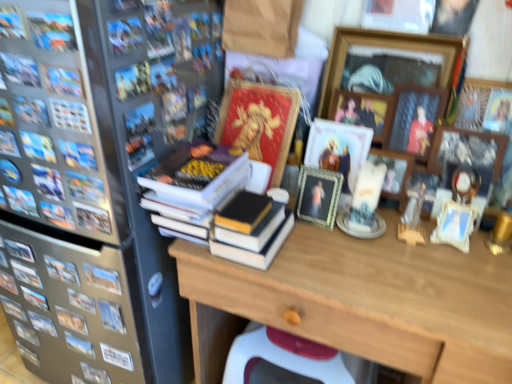
From the picture: How much space does wooden picture frame at upper center, arranged as the second picture frame when viewed from the left, occupy horizontally?

wooden picture frame at upper center, arranged as the second picture frame when viewed from the left, is 3.09 inches wide.

Measure the distance between wooden picture frame at upper center, which is counted as the fourth picture frame, starting from the right, and camera.

They are 3.39 feet apart.

This screenshot has height=384, width=512. What do you see at coordinates (224, 202) in the screenshot? I see `hardcover books at center, positioned as the 2th book in top-to-bottom order` at bounding box center [224, 202].

Where is `metallic gray refrigerator at left`? metallic gray refrigerator at left is located at coordinates (76, 218).

Identify the location of hardcover book at left, the second book when ordered from left to right. (93, 218).

Measure the distance between point (x=331, y=51) and camera.

Point (x=331, y=51) and camera are 3.61 feet apart.

You are a GUI agent. You are given a task and a screenshot of the screen. Output one action in this format:
    pyautogui.click(x=<x>, y=<y>)
    Task: Click on the green textured frame at center, placed as the first picture frame when sorted from left to right
    This screenshot has height=384, width=512.
    Given the screenshot: What is the action you would take?
    pyautogui.click(x=318, y=196)

Which is behind, red matte book at center or metallic gray refrigerator at left?

red matte book at center is further away from the camera.

Is red matte book at center placed right next to metallic gray refrigerator at left?

No, red matte book at center is not with metallic gray refrigerator at left.

In terms of height, does red matte book at center look taller or shorter compared to metallic gray refrigerator at left?

red matte book at center is shorter than metallic gray refrigerator at left.

Could you tell me if red matte book at center is facing metallic gray refrigerator at left?

No.

Looking at this image, from a real-world perspective, which is physically below, green textured frame at center, the fifth picture frame when ordered from right to left, or wooden picture frame at upper right, the third picture frame from the left?

green textured frame at center, the fifth picture frame when ordered from right to left, from a real-world perspective.

Is green textured frame at center, the fifth picture frame when ordered from right to left, not inside wooden picture frame at upper right, the third picture frame from the left?

green textured frame at center, the fifth picture frame when ordered from right to left, is positioned outside wooden picture frame at upper right, the third picture frame from the left.

Does green textured frame at center, the fifth picture frame when ordered from right to left, appear on the right side of wooden picture frame at upper right, the third picture frame from the left?

In fact, green textured frame at center, the fifth picture frame when ordered from right to left, is to the left of wooden picture frame at upper right, the third picture frame from the left.

Between green textured frame at center, the fifth picture frame when ordered from right to left, and wooden picture frame at upper right, the third picture frame from the left, which one is positioned behind?

wooden picture frame at upper right, the third picture frame from the left, is behind.

From the picture: From the image's perspective, is matte black book at upper left, which appears as the second book when viewed from the right, under wooden picture frame at upper right, arranged as the 4th picture frame when viewed from the left?

No.

Considering the relative positions of matte black book at upper left, acting as the 4th book starting from the bottom, and wooden picture frame at upper right, which is the 2th picture frame from right to left, in the image provided, is matte black book at upper left, acting as the 4th book starting from the bottom, to the right of wooden picture frame at upper right, which is the 2th picture frame from right to left, from the viewer's perspective?

No.

Considering their positions, is matte black book at upper left, the third book in the left-to-right sequence, located in front of or behind wooden picture frame at upper right, which is the 2th picture frame from right to left?

Clearly, matte black book at upper left, the third book in the left-to-right sequence, is in front of wooden picture frame at upper right, which is the 2th picture frame from right to left.

Which object is thinner, matte black book at upper left, the third book in the left-to-right sequence, or wooden picture frame at upper right, arranged as the 4th picture frame when viewed from the left?

Thinner between the two is matte black book at upper left, the third book in the left-to-right sequence.

Can you confirm if metallic gray refrigerator at left is positioned to the right of green textured frame at center, the fifth picture frame when ordered from right to left?

In fact, metallic gray refrigerator at left is to the left of green textured frame at center, the fifth picture frame when ordered from right to left.

Is metallic gray refrigerator at left spatially inside green textured frame at center, the fifth picture frame when ordered from right to left, or outside of it?

metallic gray refrigerator at left exists outside the volume of green textured frame at center, the fifth picture frame when ordered from right to left.

Starting from the metallic gray refrigerator at left, which picture frame is the 2nd one behind? Please provide its 2D coordinates.

[(318, 196)]

From the image's perspective, is hardcover book at left, the 3th book in the top-to-bottom sequence, positioned above or below hardcover book at left, the 4th book positioned from the top?

Based on their image positions, hardcover book at left, the 3th book in the top-to-bottom sequence, is located above hardcover book at left, the 4th book positioned from the top.

Is hardcover book at left, the 3th book in the top-to-bottom sequence, situated inside hardcover book at left, acting as the 1th book starting from the left, or outside?

hardcover book at left, the 3th book in the top-to-bottom sequence, is located beyond the bounds of hardcover book at left, acting as the 1th book starting from the left.

Can you confirm if hardcover book at left, the second book when ordered from left to right, is thinner than hardcover book at left, placed as the first book when sorted from bottom to top?

Correct, the width of hardcover book at left, the second book when ordered from left to right, is less than that of hardcover book at left, placed as the first book when sorted from bottom to top.

What's the angular difference between green textured frame at center, placed as the first picture frame when sorted from left to right, and wooden picture frame at upper right, the fifth picture frame in the left-to-right sequence,'s facing directions?

The angle between the facing direction of green textured frame at center, placed as the first picture frame when sorted from left to right, and the facing direction of wooden picture frame at upper right, the fifth picture frame in the left-to-right sequence, is 0.000789 degrees.

Which is more to the left, green textured frame at center, placed as the first picture frame when sorted from left to right, or wooden picture frame at upper right, the fifth picture frame in the left-to-right sequence?

Positioned to the left is green textured frame at center, placed as the first picture frame when sorted from left to right.

Considering the sizes of green textured frame at center, the fifth picture frame when ordered from right to left, and wooden picture frame at upper right, the fifth picture frame in the left-to-right sequence, in the image, is green textured frame at center, the fifth picture frame when ordered from right to left, taller or shorter than wooden picture frame at upper right, the fifth picture frame in the left-to-right sequence,?

Clearly, green textured frame at center, the fifth picture frame when ordered from right to left, is shorter compared to wooden picture frame at upper right, the fifth picture frame in the left-to-right sequence.

From a real-world perspective, is green textured frame at center, placed as the first picture frame when sorted from left to right, under wooden picture frame at upper right, the fifth picture frame in the left-to-right sequence?

Yes, from a real-world perspective, green textured frame at center, placed as the first picture frame when sorted from left to right, is beneath wooden picture frame at upper right, the fifth picture frame in the left-to-right sequence.

Is wooden picture frame at upper right, arranged as the 4th picture frame when viewed from the left, thinner than hardcover books at center, the 3th book positioned from the bottom?

Indeed, wooden picture frame at upper right, arranged as the 4th picture frame when viewed from the left, has a lesser width compared to hardcover books at center, the 3th book positioned from the bottom.

From the image's perspective, which one is positioned lower, wooden picture frame at upper right, arranged as the 4th picture frame when viewed from the left, or hardcover books at center, the first book positioned from the right?

From the image's view, hardcover books at center, the first book positioned from the right, is below.

From a real-world perspective, which object rests below the other?

hardcover books at center, the 3th book positioned from the bottom.

At what (x,y) coordinates should I click in order to perform the action: click on refrigerator that appears on the left of red matte book at center. Please return your answer as a coordinate pair (x, y). Looking at the image, I should click on (76, 218).

This screenshot has height=384, width=512. I want to click on the 2nd picture frame in front of the wooden picture frame at upper right, marked as the third picture frame in a right-to-left arrangement, starting your count from the anchor, so click(318, 196).

From the image, which object appears to be farther from red matte book at center, wooden picture frame at upper right, the third picture frame from the left, or matte black book at upper left, acting as the 4th book starting from the bottom?

Based on the image, matte black book at upper left, acting as the 4th book starting from the bottom, appears to be further to red matte book at center.

From the image, which object appears to be farther from wooden desk at center, hardcover book at left, the 4th book positioned from the top, or wooden picture frame at upper right, marked as the third picture frame in a right-to-left arrangement?

The object further to wooden desk at center is hardcover book at left, the 4th book positioned from the top.

From the image, which object appears to be farther from hardcover book at left, placed as the first book when sorted from bottom to top, green textured frame at center, the fifth picture frame when ordered from right to left, or red matte book at center?

Based on the image, green textured frame at center, the fifth picture frame when ordered from right to left, appears to be further to hardcover book at left, placed as the first book when sorted from bottom to top.

When comparing their distances from wooden picture frame at upper right, the fifth picture frame in the left-to-right sequence, does wooden picture frame at upper right, which is the 2th picture frame from right to left, or wooden desk at center seem closer?

The object closer to wooden picture frame at upper right, the fifth picture frame in the left-to-right sequence, is wooden picture frame at upper right, which is the 2th picture frame from right to left.

From the image, which object appears to be nearer to hardcover book at left, which is the 3th book in right-to-left order, matte black book at upper left, acting as the 4th book starting from the bottom, or metallic gray refrigerator at left?

metallic gray refrigerator at left.

Which object lies nearer to the anchor point wooden desk at center, hardcover book at left, the 4th book positioned from the top, or green textured frame at center, placed as the first picture frame when sorted from left to right?

green textured frame at center, placed as the first picture frame when sorted from left to right, is closer to wooden desk at center.

Based on their spatial positions, is wooden picture frame at upper right, the third picture frame from the left, or hardcover books at center, the first book positioned from the right, further from hardcover book at left, acting as the 1th book starting from the left?

wooden picture frame at upper right, the third picture frame from the left, is positioned further to the anchor hardcover book at left, acting as the 1th book starting from the left.

Which object lies further to the anchor point matte black book at upper left, acting as the 4th book starting from the bottom, metallic gray refrigerator at left or hardcover book at left, the second book when ordered from left to right?

metallic gray refrigerator at left lies further to matte black book at upper left, acting as the 4th book starting from the bottom, than the other object.

The width and height of the screenshot is (512, 384). Find the location of `book between red matte book at center and green textured frame at center, placed as the first picture frame when sorted from left to right, in the up-down direction`. book between red matte book at center and green textured frame at center, placed as the first picture frame when sorted from left to right, in the up-down direction is located at coordinates (224, 202).

Where is `refrigerator that lies between matte black book at upper left, which appears as the second book when viewed from the right, and hardcover book at left, which is the 3th book in right-to-left order, from top to bottom`? The image size is (512, 384). refrigerator that lies between matte black book at upper left, which appears as the second book when viewed from the right, and hardcover book at left, which is the 3th book in right-to-left order, from top to bottom is located at coordinates (76, 218).

Where is `paperback book situated between matte black book at upper left, the 1th book from the top, and wooden picture frame at upper right, which is the 2th picture frame from right to left, from left to right`? The image size is (512, 384). paperback book situated between matte black book at upper left, the 1th book from the top, and wooden picture frame at upper right, which is the 2th picture frame from right to left, from left to right is located at coordinates (259, 122).

Where is `paperback book between hardcover book at left, acting as the 1th book starting from the left, and wooden picture frame at upper right, which is the 1th picture frame from right to left`? The width and height of the screenshot is (512, 384). paperback book between hardcover book at left, acting as the 1th book starting from the left, and wooden picture frame at upper right, which is the 1th picture frame from right to left is located at coordinates (259, 122).